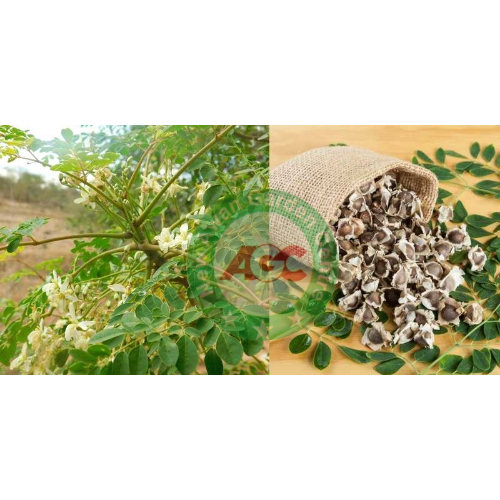
This screenshot has height=500, width=500. In order to click on dried flowers are spilling onto the table in this screenshot , I will do `click(480, 420)`, `click(401, 259)`.